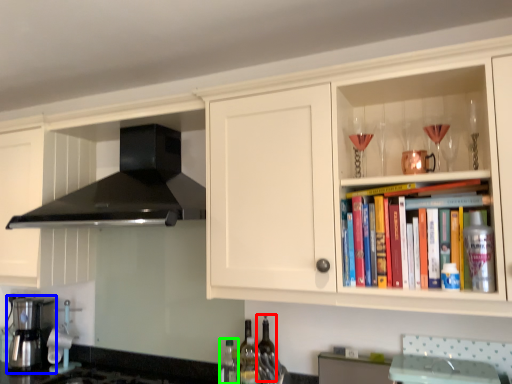
Question: Which is farther away from bottle (highlighted by a red box)? kitchen appliance (highlighted by a blue box) or bottle (highlighted by a green box)?

Choices:
 (A) kitchen appliance
 (B) bottle

Answer: (A)